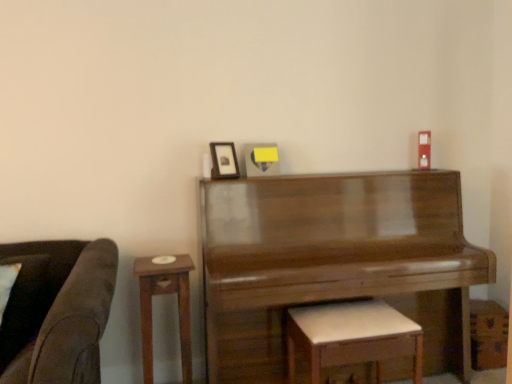
This screenshot has height=384, width=512. Find the location of `vacant area that is situated to the right of matte black picture frame at upper center`. vacant area that is situated to the right of matte black picture frame at upper center is located at coordinates (251, 177).